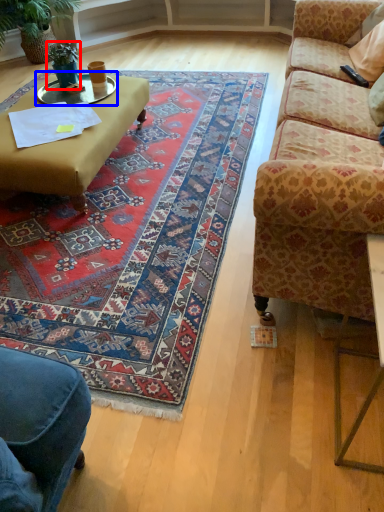
Question: Among these objects, which one is nearest to the camera, houseplant (highlighted by a red box) or glass table (highlighted by a blue box)?

Choices:
 (A) houseplant
 (B) glass table

Answer: (B)